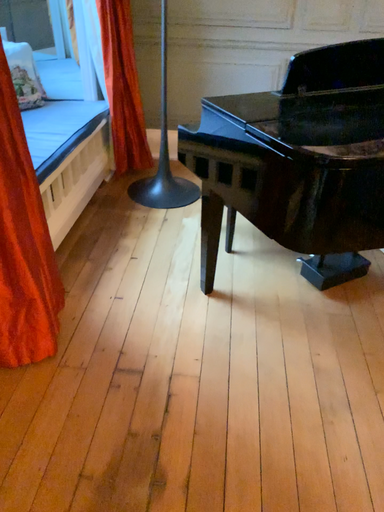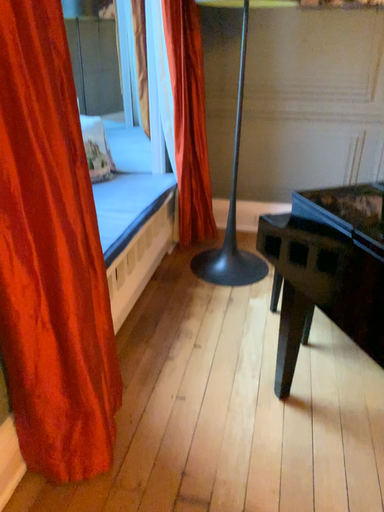
Question: Which way did the camera rotate in the video?

Choices:
 (A) rotated downward
 (B) rotated upward

Answer: (B)